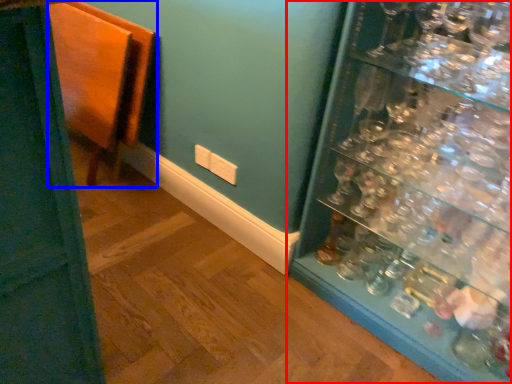
Question: Which of the following is the farthest to the observer, shelf (highlighted by a red box) or furniture (highlighted by a blue box)?

Choices:
 (A) shelf
 (B) furniture

Answer: (B)